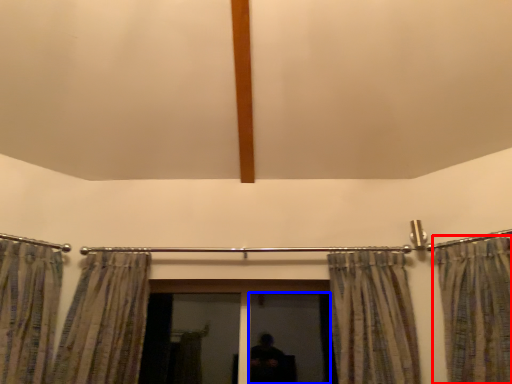
Question: Which of the following is the farthest to the observer, curtain (highlighted by a red box) or screen door (highlighted by a blue box)?

Choices:
 (A) curtain
 (B) screen door

Answer: (B)